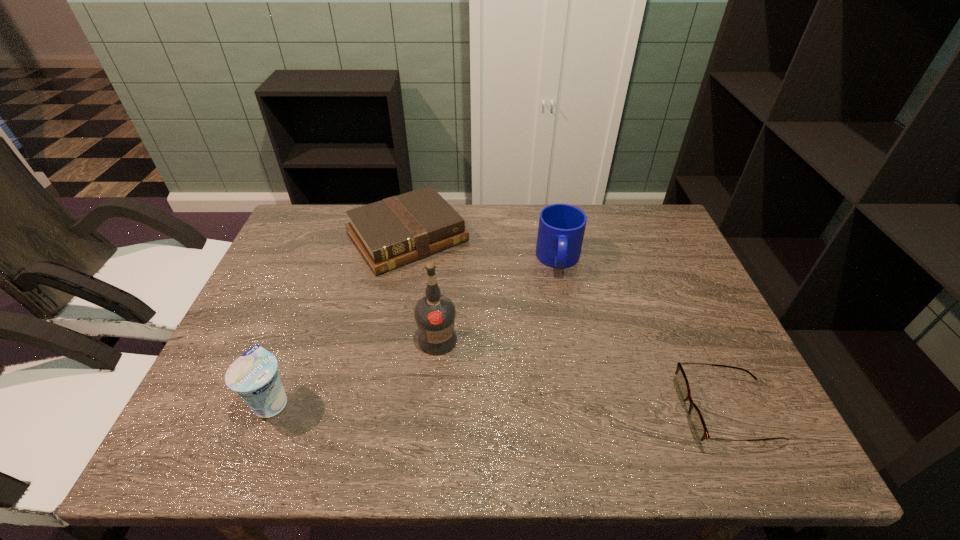
Where is `yogurt`? yogurt is located at coordinates (254, 376).

This screenshot has height=540, width=960. In order to click on the shortest object in this screenshot , I will do `click(697, 425)`.

Where is `the rightmost object`? the rightmost object is located at coordinates (697, 425).

Find the location of `the second shortest object`. the second shortest object is located at coordinates (389, 233).

Image resolution: width=960 pixels, height=540 pixels. Find the location of `the fourth object from left to right`. the fourth object from left to right is located at coordinates (561, 229).

This screenshot has height=540, width=960. I want to click on the tallest object, so click(x=435, y=314).

Locate an element on the screen. Image resolution: width=960 pixels, height=540 pixels. the third nearest object is located at coordinates pyautogui.click(x=435, y=314).

You are a GUI agent. You are given a task and a screenshot of the screen. Output one action in this format:
    pyautogui.click(x=<x>, y=<y>)
    Task: Click on the vacant space located on the back of the yogurt
    
    Given the screenshot: What is the action you would take?
    pyautogui.click(x=293, y=347)

Where is `blank space located 0.270m on the face of the rightmost object`? blank space located 0.270m on the face of the rightmost object is located at coordinates (554, 412).

Find the location of a particular element. vacant space located 0.230m on the face of the rightmost object is located at coordinates (573, 412).